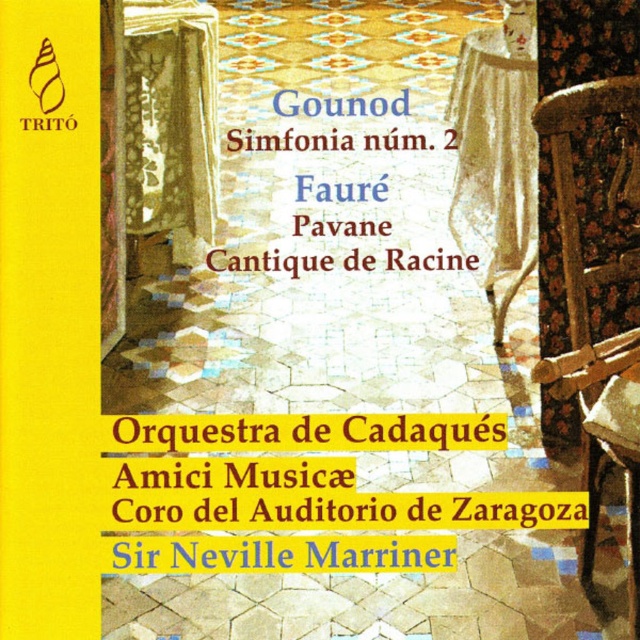
You are designing a layout for a new classical music album cover. You want to place a new element between the patterned fabric tablecloth at upper left and the white lace tablecloth at upper right. Based on their positions, where should you place this new element?

The patterned fabric tablecloth at upper left is above the white lace tablecloth at upper right, so the new element should be placed between them in the space below the patterned fabric tablecloth at upper left and above the white lace tablecloth at upper right.

You are designing a layout for a classical music album cover. The scene includes a wooden chair at right and a stone column with intricate carvings on the left. You need to place a logo at the exact center of the image. Is the current logo at point (588, 314) positioned at the center?

The point (588, 314) is where the wooden chair at right is located, so the logo is not at the center of the image.